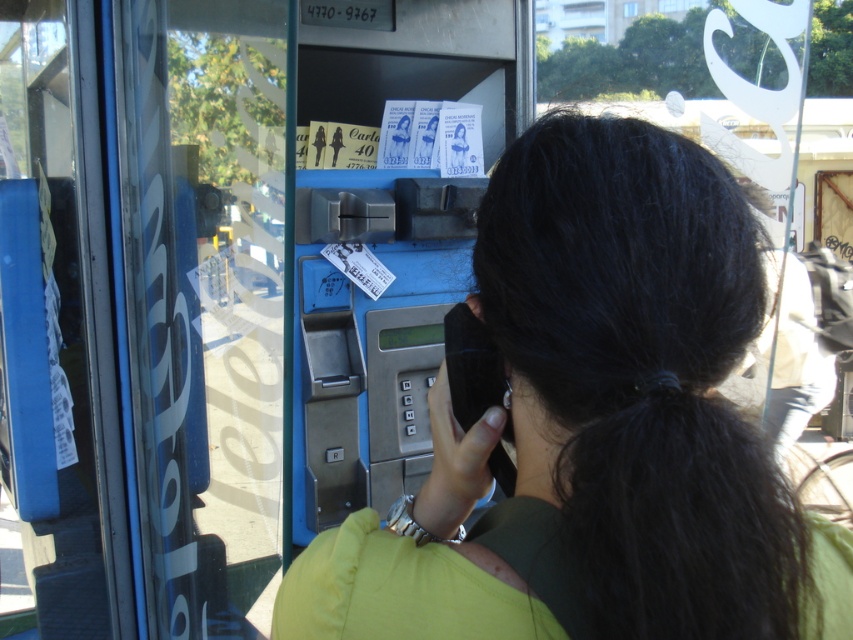
Which of these two, green fabric shirt at center or blue metallic phone box at center, stands shorter?

green fabric shirt at center is shorter.

From the picture: Between green fabric shirt at center and blue metallic phone box at center, which one has more height?

blue metallic phone box at center

Which is behind, point (534, 220) or point (329, 220)?

Positioned behind is point (329, 220).

Where is `green fabric shirt at center`? The image size is (853, 640). green fabric shirt at center is located at coordinates (596, 426).